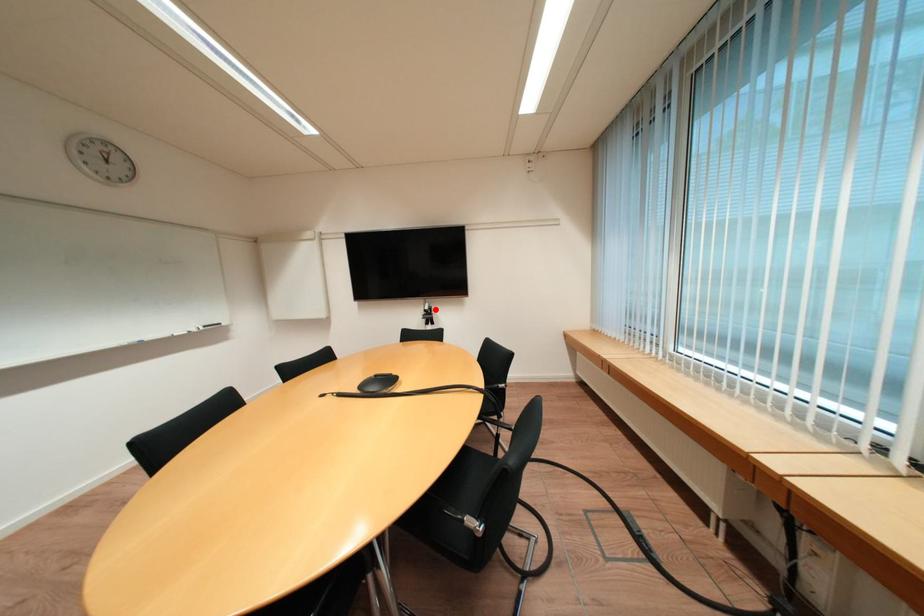
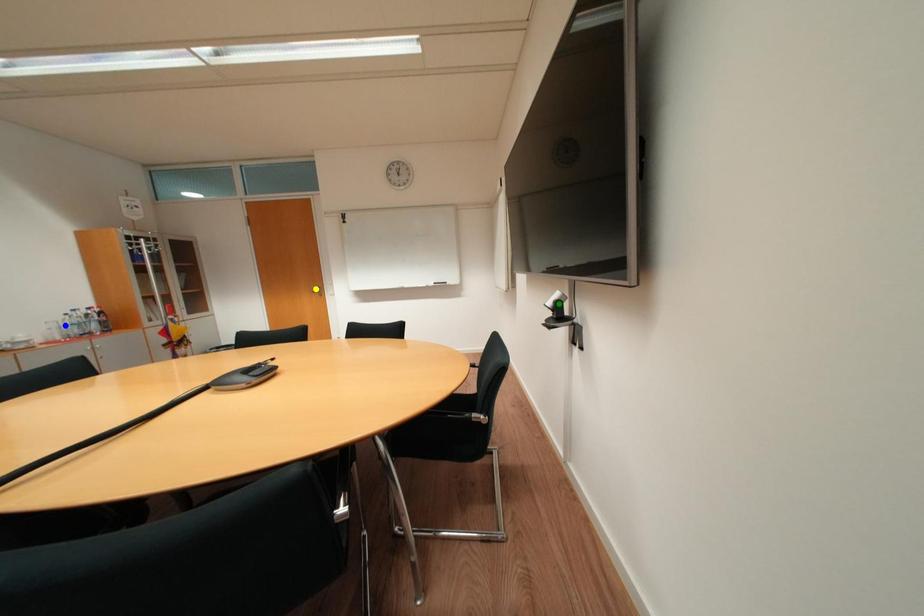
Question: I am providing you with two images of the same scene from different viewpoints. A red point is marked on the first image. You are given multiple points on the second image. In image 2, which mark is for the same physical point as the one in image 1?

Choices:
 (A) blue point
 (B) green point
 (C) yellow point

Answer: (B)